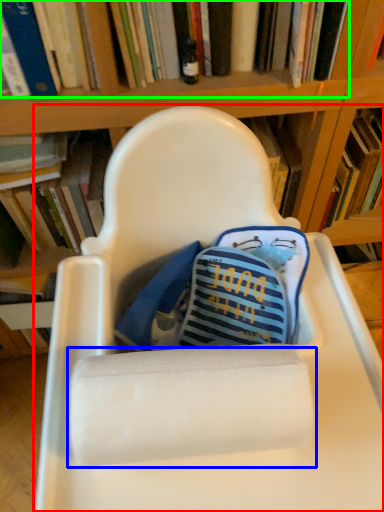
Question: Which object is positioned closest to chair (highlighted by a red box)? Select from paper towel (highlighted by a blue box) and book (highlighted by a green box).

Choices:
 (A) paper towel
 (B) book

Answer: (A)